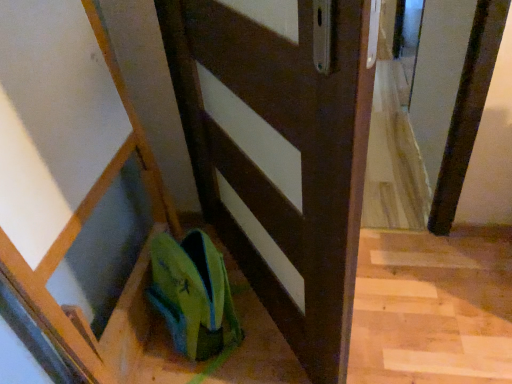
Question: In terms of width, does matte brown door at center look wider or thinner when compared to green fabric shoe at lower center?

Choices:
 (A) thin
 (B) wide

Answer: (A)

Question: From the image's perspective, is matte brown door at center located above or below green fabric shoe at lower center?

Choices:
 (A) below
 (B) above

Answer: (B)

Question: Considering the positions of matte brown door at center and green fabric shoe at lower center in the image, is matte brown door at center taller or shorter than green fabric shoe at lower center?

Choices:
 (A) tall
 (B) short

Answer: (A)

Question: Considering the positions of green fabric shoe at lower center and matte brown door at center in the image, is green fabric shoe at lower center taller or shorter than matte brown door at center?

Choices:
 (A) tall
 (B) short

Answer: (B)

Question: Does point (234, 314) appear closer or farther from the camera than point (205, 132)?

Choices:
 (A) farther
 (B) closer

Answer: (A)

Question: Looking at their shapes, would you say green fabric shoe at lower center is wider or thinner than matte brown door at center?

Choices:
 (A) wide
 (B) thin

Answer: (A)

Question: From a real-world perspective, relative to matte brown door at center, is green fabric shoe at lower center vertically above or below?

Choices:
 (A) above
 (B) below

Answer: (B)